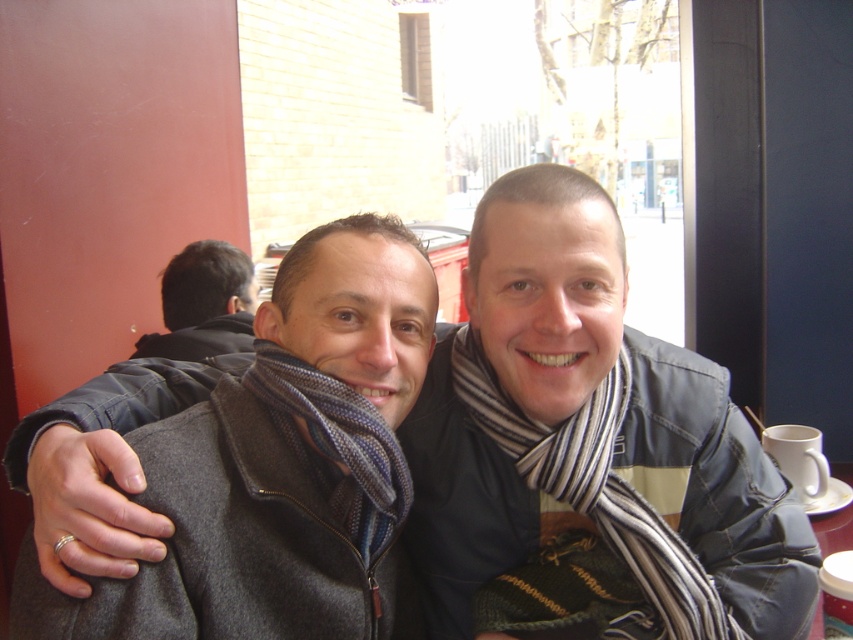
Question: Which point is closer to the camera taking this photo?

Choices:
 (A) (734, 611)
 (B) (291, 419)

Answer: (B)

Question: Can you confirm if striped scarf at center is positioned to the left of striped wool scarf at center?

Choices:
 (A) yes
 (B) no

Answer: (B)

Question: Does striped scarf at center have a larger size compared to striped wool scarf at center?

Choices:
 (A) yes
 (B) no

Answer: (A)

Question: Considering the relative positions of striped scarf at center and dark gray wool scarf at center in the image provided, where is striped scarf at center located with respect to dark gray wool scarf at center?

Choices:
 (A) left
 (B) right

Answer: (B)

Question: Which object is closer to the camera taking this photo?

Choices:
 (A) dark brown hair at upper left
 (B) striped wool scarf at center
 (C) striped scarf at center

Answer: (C)

Question: Which point is farther from the camera taking this photo?

Choices:
 (A) (292, 522)
 (B) (267, 356)
 (C) (228, 298)

Answer: (C)